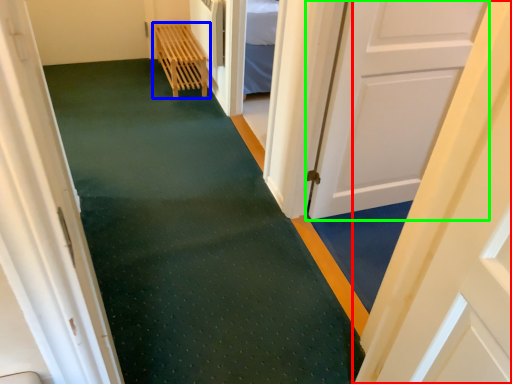
Question: Which object is the closest to the door (highlighted by a red box)? Choose among these: furniture (highlighted by a blue box) or door (highlighted by a green box).

Choices:
 (A) furniture
 (B) door

Answer: (B)